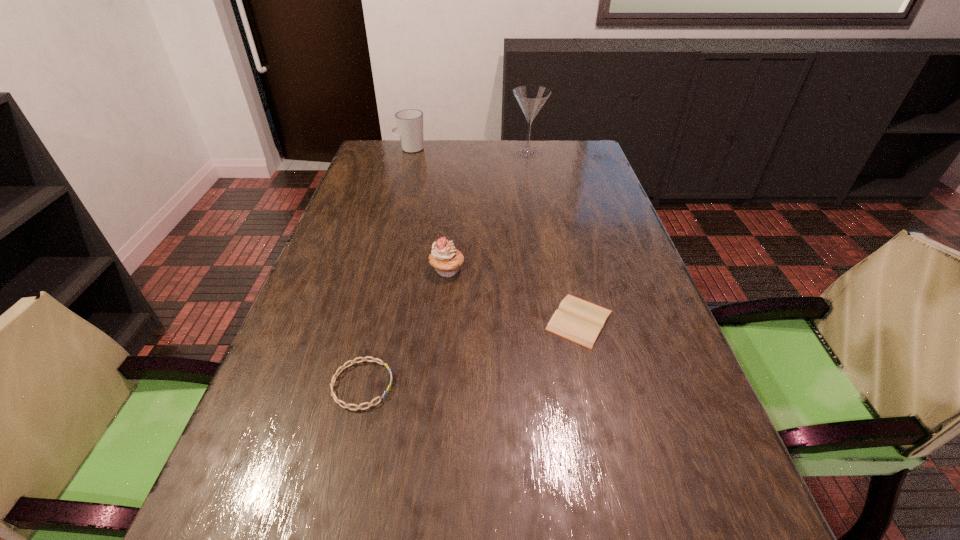
In the image, there is a desktop. Identify the location of vacant space at the far right corner. (549, 150).

Locate an element on the screen. This screenshot has width=960, height=540. vacant area that lies between the cup and the tallest object is located at coordinates 468,151.

Where is `vacant space that's between the diary and the bracelet`? The height and width of the screenshot is (540, 960). vacant space that's between the diary and the bracelet is located at coordinates (470, 353).

The height and width of the screenshot is (540, 960). I want to click on free space that is in between the cupcake and the fourth farthest object, so click(x=514, y=295).

Where is `unoccupied position between the flute glass and the second tallest object`? Image resolution: width=960 pixels, height=540 pixels. unoccupied position between the flute glass and the second tallest object is located at coordinates (468, 151).

Find the location of a particular element. This screenshot has width=960, height=540. vacant area that lies between the third nearest object and the cup is located at coordinates (429, 210).

Locate an element on the screen. This screenshot has height=540, width=960. unoccupied area between the bracelet and the cup is located at coordinates (386, 267).

Find the location of a particular element. vacant area that lies between the cupcake and the tallest object is located at coordinates (488, 211).

The image size is (960, 540). Find the location of `unoccupied position between the diary and the nearest object`. unoccupied position between the diary and the nearest object is located at coordinates (470, 353).

Where is `the fourth closest object to the diary`? The height and width of the screenshot is (540, 960). the fourth closest object to the diary is located at coordinates (409, 122).